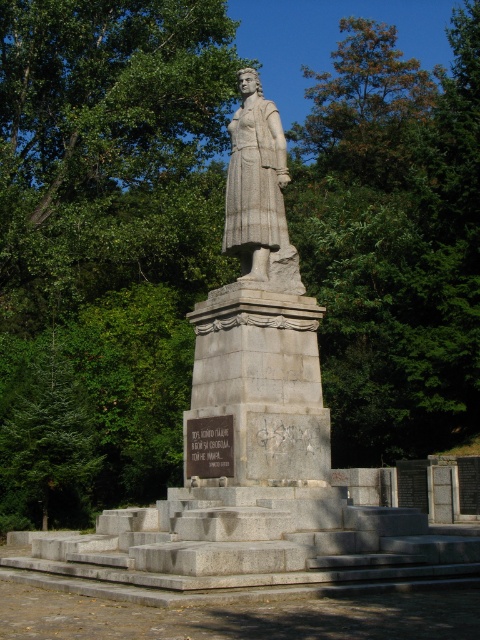
You are an artist planning to sketch the scene. You need to ensure that the proportions between the gray stone statue at center and the gray stone plaque at center are accurate. Which object should you draw wider in your sketch?

The gray stone statue at center should be drawn wider in the sketch since its width is larger than the gray stone plaque at center.

You are a tour guide explaining the statue and plaque to visitors. You want to ensure visitors know the correct viewing order. Which should they look at first, the gray stone statue at center or the gray stone plaque at center?

The gray stone statue at center is positioned over the gray stone plaque at center, so visitors should look at the gray stone statue at center first as it is above the plaque.

You are standing in front of the statue and want to take a photo of the green leafy tree at upper center. According to the coordinates provided, where should you position your camera to capture the tree in the center of your photo?

The green leafy tree at upper center is located at coordinates point (365, 108). To center it in your photo, position your camera so that the tree is aligned with the center point of your viewfinder at those coordinates.